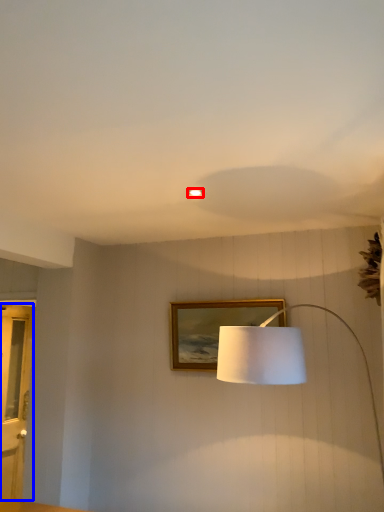
Question: Which of the following is the closest to the observer, lighting (highlighted by a red box) or glass door (highlighted by a blue box)?

Choices:
 (A) lighting
 (B) glass door

Answer: (A)